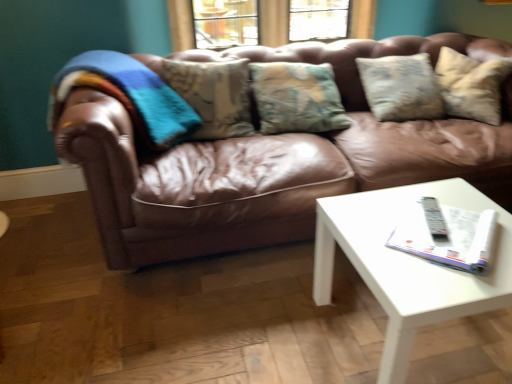
At what (x,y) coordinates should I click in order to perform the action: click on vacant space underneath white glossy magazine at center right (from a real-world perspective). Please return your answer as a coordinate pair (x, y). Image resolution: width=512 pixels, height=384 pixels. Looking at the image, I should click on (442, 233).